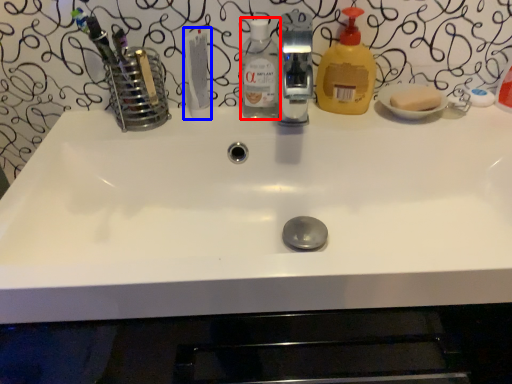
Question: Among these objects, which one is farthest to the camera, bottle (highlighted by a red box) or toothpaste (highlighted by a blue box)?

Choices:
 (A) bottle
 (B) toothpaste

Answer: (A)